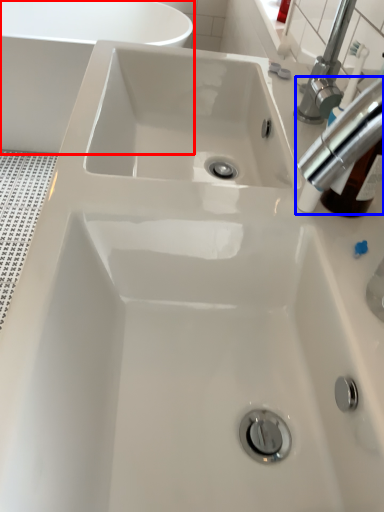
Question: Which of the following is the closest to the observer, bath (highlighted by a red box) or tap (highlighted by a blue box)?

Choices:
 (A) bath
 (B) tap

Answer: (B)